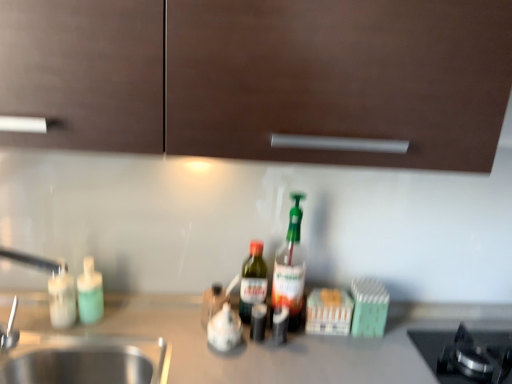
Where is `translucent plastic bottle at center, the 4th bottle viewed from the left`? This screenshot has width=512, height=384. translucent plastic bottle at center, the 4th bottle viewed from the left is located at coordinates (290, 268).

In order to face green glass bottle at center, the third bottle positioned from the left, should I rotate leftwards or rightwards?

Rotate your view left by about 0.442°.

Where is `matte green soap dispenser at left, which appears as the 2th bottle when viewed from the left`? matte green soap dispenser at left, which appears as the 2th bottle when viewed from the left is located at coordinates pyautogui.click(x=90, y=293).

What is the approximate width of matte green soap dispenser at left, which is the third bottle from right to left?

matte green soap dispenser at left, which is the third bottle from right to left, is 3.70 inches in width.

The image size is (512, 384). Identify the location of silver metallic faucet at left. (35, 261).

What do you see at coordinates (62, 298) in the screenshot?
I see `white glossy soap dispenser at left, placed as the fourth bottle when sorted from right to left` at bounding box center [62, 298].

Where is `translucent plastic bottle at center, the 4th bottle viewed from the left`? The image size is (512, 384). translucent plastic bottle at center, the 4th bottle viewed from the left is located at coordinates (290, 268).

Consider the image. In the image, is silver metallic faucet at left on the left side or the right side of matte green soap dispenser at left, which appears as the 2th bottle when viewed from the left?

silver metallic faucet at left is to the left of matte green soap dispenser at left, which appears as the 2th bottle when viewed from the left.

Does silver metallic faucet at left have a smaller size compared to matte green soap dispenser at left, which appears as the 2th bottle when viewed from the left?

No, silver metallic faucet at left is not smaller than matte green soap dispenser at left, which appears as the 2th bottle when viewed from the left.

Does silver metallic faucet at left have a greater height compared to matte green soap dispenser at left, which is the third bottle from right to left?

Indeed, silver metallic faucet at left has a greater height compared to matte green soap dispenser at left, which is the third bottle from right to left.

Consider the image. Which object is thinner, silver metallic faucet at left or matte green soap dispenser at left, which appears as the 2th bottle when viewed from the left?

matte green soap dispenser at left, which appears as the 2th bottle when viewed from the left.

From the image's perspective, which one is positioned lower, silver metallic faucet at left or white glossy soap dispenser at left, arranged as the first bottle when viewed from the left?

white glossy soap dispenser at left, arranged as the first bottle when viewed from the left, appears lower in the image.

Based on the photo, between silver metallic faucet at left and white glossy soap dispenser at left, arranged as the first bottle when viewed from the left, which one is positioned behind?

white glossy soap dispenser at left, arranged as the first bottle when viewed from the left, is further away from the camera.

Which object is wider, silver metallic faucet at left or white glossy soap dispenser at left, arranged as the first bottle when viewed from the left?

silver metallic faucet at left is wider.

What's the angular difference between green glass bottle at center, the third bottle positioned from the left, and matte green soap dispenser at left, which is the third bottle from right to left,'s facing directions?

There is a 0.902-degree angle between the facing directions of green glass bottle at center, the third bottle positioned from the left, and matte green soap dispenser at left, which is the third bottle from right to left.

Is green glass bottle at center, the third bottle positioned from the left, at the left side of matte green soap dispenser at left, which is the third bottle from right to left?

Incorrect, green glass bottle at center, the third bottle positioned from the left, is not on the left side of matte green soap dispenser at left, which is the third bottle from right to left.

Is point (259, 300) closer or farther from the camera than point (92, 311)?

Point (259, 300).

Can you confirm if green glass bottle at center, the third bottle positioned from the left, is smaller than matte green soap dispenser at left, which appears as the 2th bottle when viewed from the left?

No, green glass bottle at center, the third bottle positioned from the left, is not smaller than matte green soap dispenser at left, which appears as the 2th bottle when viewed from the left.

Who is taller, translucent plastic bottle at center, the 4th bottle viewed from the left, or white glossy soap dispenser at left, arranged as the first bottle when viewed from the left?

Standing taller between the two is translucent plastic bottle at center, the 4th bottle viewed from the left.

Considering the sizes of objects translucent plastic bottle at center, the 4th bottle viewed from the left, and white glossy soap dispenser at left, arranged as the first bottle when viewed from the left, in the image provided, who is wider, translucent plastic bottle at center, the 4th bottle viewed from the left, or white glossy soap dispenser at left, arranged as the first bottle when viewed from the left,?

translucent plastic bottle at center, the 4th bottle viewed from the left, is wider.

Is translucent plastic bottle at center, the 4th bottle viewed from the left, in front of or behind white glossy soap dispenser at left, placed as the fourth bottle when sorted from right to left, in the image?

translucent plastic bottle at center, the 4th bottle viewed from the left, is positioned farther from the viewer than white glossy soap dispenser at left, placed as the fourth bottle when sorted from right to left.

From the image's perspective, is silver metallic faucet at left located above or below translucent plastic bottle at center, the 4th bottle viewed from the left?

silver metallic faucet at left is below translucent plastic bottle at center, the 4th bottle viewed from the left.

You are a GUI agent. You are given a task and a screenshot of the screen. Output one action in this format:
    pyautogui.click(x=<x>, y=<y>)
    Task: Click on the bottle that is the 2nd object located behind the silver metallic faucet at left
    The height and width of the screenshot is (384, 512).
    Given the screenshot: What is the action you would take?
    pyautogui.click(x=290, y=268)

Looking at this image, considering the sizes of silver metallic faucet at left and translucent plastic bottle at center, the first bottle in the right-to-left sequence, in the image, is silver metallic faucet at left taller or shorter than translucent plastic bottle at center, the first bottle in the right-to-left sequence,?

Considering their sizes, silver metallic faucet at left has less height than translucent plastic bottle at center, the first bottle in the right-to-left sequence.

Choose the correct answer: Is silver metallic faucet at left inside translucent plastic bottle at center, the 4th bottle viewed from the left, or outside it?

silver metallic faucet at left is outside translucent plastic bottle at center, the 4th bottle viewed from the left.

From the image's perspective, is green glass bottle at center, the third bottle positioned from the left, above or below translucent plastic bottle at center, the 4th bottle viewed from the left?

→ Clearly, from the image's perspective, green glass bottle at center, the third bottle positioned from the left, is below translucent plastic bottle at center, the 4th bottle viewed from the left.

Is translucent plastic bottle at center, the first bottle in the right-to-left sequence, completely or partially inside green glass bottle at center, the third bottle positioned from the left?

No, translucent plastic bottle at center, the first bottle in the right-to-left sequence, is located outside of green glass bottle at center, the third bottle positioned from the left.

Is point (252, 284) in front of point (276, 278)?

No.

Would you consider green glass bottle at center, which is counted as the second bottle, starting from the right, to be distant from translucent plastic bottle at center, the 4th bottle viewed from the left?

No.

There is a white glossy soap dispenser at left, arranged as the first bottle when viewed from the left. Where is `faucet above it (from a real-world perspective)`? The width and height of the screenshot is (512, 384). faucet above it (from a real-world perspective) is located at coordinates (35, 261).

Which object is thinner, white glossy soap dispenser at left, arranged as the first bottle when viewed from the left, or silver metallic faucet at left?

Thinner between the two is white glossy soap dispenser at left, arranged as the first bottle when viewed from the left.

Is white glossy soap dispenser at left, placed as the fourth bottle when sorted from right to left, taller than silver metallic faucet at left?

Incorrect, the height of white glossy soap dispenser at left, placed as the fourth bottle when sorted from right to left, is not larger of that of silver metallic faucet at left.

Are white glossy soap dispenser at left, placed as the fourth bottle when sorted from right to left, and silver metallic faucet at left making contact?

Absolutely, white glossy soap dispenser at left, placed as the fourth bottle when sorted from right to left, is next to and touching silver metallic faucet at left.

Identify the location of faucet positioned vertically above the matte green soap dispenser at left, which is the third bottle from right to left (from a real-world perspective). (35, 261).

Find the location of a particular element. The height and width of the screenshot is (384, 512). faucet above the white glossy soap dispenser at left, placed as the fourth bottle when sorted from right to left (from the image's perspective) is located at coordinates (35, 261).

Looking at the image, which one is located closer to matte green soap dispenser at left, which appears as the 2th bottle when viewed from the left, silver metallic faucet at left or translucent plastic bottle at center, the 4th bottle viewed from the left?

Among the two, silver metallic faucet at left is located nearer to matte green soap dispenser at left, which appears as the 2th bottle when viewed from the left.

When comparing their distances from white glossy soap dispenser at left, placed as the fourth bottle when sorted from right to left, does silver metallic faucet at left or translucent plastic bottle at center, the 4th bottle viewed from the left, seem closer?

Among the two, silver metallic faucet at left is located nearer to white glossy soap dispenser at left, placed as the fourth bottle when sorted from right to left.

From the image, which object appears to be farther from matte green soap dispenser at left, which is the third bottle from right to left, translucent plastic bottle at center, the 4th bottle viewed from the left, or green glass bottle at center, which is counted as the second bottle, starting from the right?

The object further to matte green soap dispenser at left, which is the third bottle from right to left, is translucent plastic bottle at center, the 4th bottle viewed from the left.

Which object lies further to the anchor point green glass bottle at center, the third bottle positioned from the left, matte green soap dispenser at left, which appears as the 2th bottle when viewed from the left, or translucent plastic bottle at center, the 4th bottle viewed from the left?

matte green soap dispenser at left, which appears as the 2th bottle when viewed from the left.

Estimate the real-world distances between objects in this image. Which object is closer to translucent plastic bottle at center, the first bottle in the right-to-left sequence, matte green soap dispenser at left, which appears as the 2th bottle when viewed from the left, or white glossy soap dispenser at left, placed as the fourth bottle when sorted from right to left?

matte green soap dispenser at left, which appears as the 2th bottle when viewed from the left, lies closer to translucent plastic bottle at center, the first bottle in the right-to-left sequence, than the other object.

When comparing their distances from silver metallic faucet at left, does matte green soap dispenser at left, which appears as the 2th bottle when viewed from the left, or translucent plastic bottle at center, the 4th bottle viewed from the left, seem further?

Based on the image, translucent plastic bottle at center, the 4th bottle viewed from the left, appears to be further to silver metallic faucet at left.

Based on their spatial positions, is matte green soap dispenser at left, which appears as the 2th bottle when viewed from the left, or green glass bottle at center, the third bottle positioned from the left, further from translucent plastic bottle at center, the first bottle in the right-to-left sequence?

Among the two, matte green soap dispenser at left, which appears as the 2th bottle when viewed from the left, is located further to translucent plastic bottle at center, the first bottle in the right-to-left sequence.

Looking at the image, which one is located further to matte green soap dispenser at left, which appears as the 2th bottle when viewed from the left, white glossy soap dispenser at left, placed as the fourth bottle when sorted from right to left, or translucent plastic bottle at center, the 4th bottle viewed from the left?

translucent plastic bottle at center, the 4th bottle viewed from the left, is positioned further to the anchor matte green soap dispenser at left, which appears as the 2th bottle when viewed from the left.

Locate an element on the screen. This screenshot has height=384, width=512. bottle between white glossy soap dispenser at left, placed as the fourth bottle when sorted from right to left, and green glass bottle at center, the third bottle positioned from the left is located at coordinates (90, 293).

Where is `bottle between matte green soap dispenser at left, which is the third bottle from right to left, and translucent plastic bottle at center, the 4th bottle viewed from the left`? This screenshot has width=512, height=384. bottle between matte green soap dispenser at left, which is the third bottle from right to left, and translucent plastic bottle at center, the 4th bottle viewed from the left is located at coordinates (252, 281).